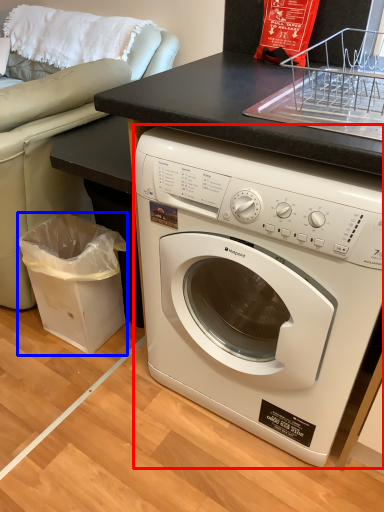
Question: Which object is closer to the camera taking this photo, washing machine (highlighted by a red box) or garbage (highlighted by a blue box)?

Choices:
 (A) washing machine
 (B) garbage

Answer: (A)